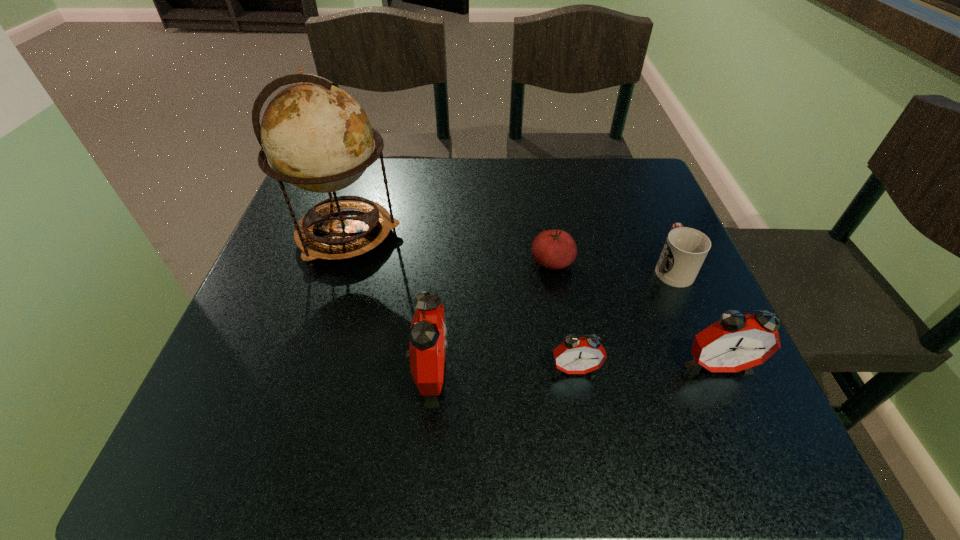
Find the location of `free spot located 0.100m on the front of the tomato`. free spot located 0.100m on the front of the tomato is located at coordinates (561, 317).

This screenshot has width=960, height=540. Find the location of `free point located on the handle side of the cup`. free point located on the handle side of the cup is located at coordinates (632, 173).

You are a GUI agent. You are given a task and a screenshot of the screen. Output one action in this format:
    pyautogui.click(x=<x>, y=<y>)
    Task: Click on the free spot located on the handle side of the cup
    Image resolution: width=960 pixels, height=540 pixels.
    Given the screenshot: What is the action you would take?
    pyautogui.click(x=641, y=195)

Locate an element on the screen. The image size is (960, 540). vacant space located 0.340m on the handle side of the cup is located at coordinates (628, 164).

At what (x,y) coordinates should I click in order to perform the action: click on object present at the far edge. Please return your answer as a coordinate pair (x, y). Image resolution: width=960 pixels, height=540 pixels. Looking at the image, I should click on (317, 137).

Image resolution: width=960 pixels, height=540 pixels. I want to click on object situated at the left edge, so click(317, 137).

I want to click on alarm clock present at the right edge, so 736,342.

This screenshot has width=960, height=540. What are the coordinates of `cup positioned at the right edge` in the screenshot? It's located at (685, 249).

At what (x,y) coordinates should I click in order to perform the action: click on object that is positioned at the far left corner. Please return your answer as a coordinate pair (x, y). Image resolution: width=960 pixels, height=540 pixels. Looking at the image, I should click on (317, 137).

I want to click on object located at the near right corner, so pyautogui.click(x=736, y=342).